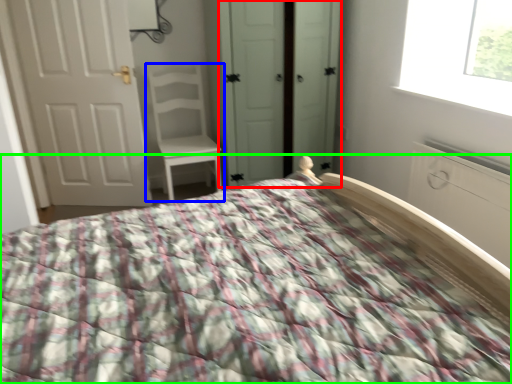
Question: Which is farther away from screen door (highlighted by a red box)? chair (highlighted by a blue box) or bed (highlighted by a green box)?

Choices:
 (A) chair
 (B) bed

Answer: (B)